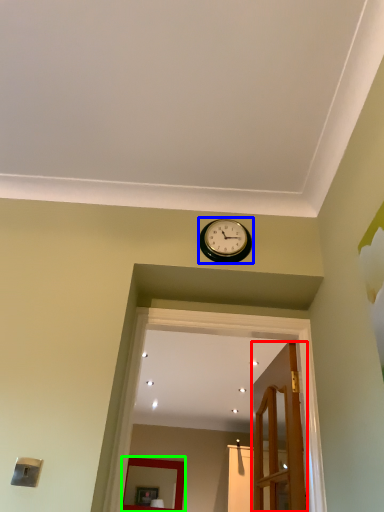
Question: Considering the real-world distances, which object is closest to door (highlighted by a red box)? wall clock (highlighted by a blue box) or mirror (highlighted by a green box).

Choices:
 (A) wall clock
 (B) mirror

Answer: (A)